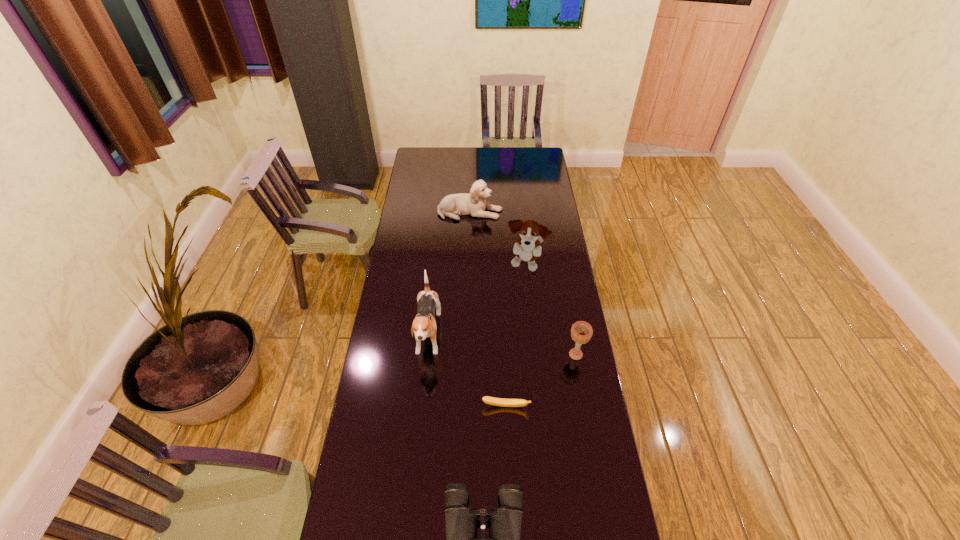
Find the location of a particular element. The width and height of the screenshot is (960, 540). empty space that is in between the farthest object and the shortest object is located at coordinates (488, 309).

You are a GUI agent. You are given a task and a screenshot of the screen. Output one action in this format:
    pyautogui.click(x=<x>, y=<y>)
    Task: Click on the empty space between the second farthest object and the chalice
    
    Given the screenshot: What is the action you would take?
    pyautogui.click(x=551, y=310)

Find the location of a particular element. empty location between the chalice and the second farthest object is located at coordinates (551, 310).

Point out which object is positioned as the second nearest to the farthest puppy. Please provide its 2D coordinates. Your answer should be formatted as a tuple, i.e. [(x, y)], where the tuple contains the x and y coordinates of a point satisfying the conditions above.

[(424, 325)]

This screenshot has height=540, width=960. I want to click on the fifth closest object relative to the nearest puppy, so click(474, 203).

At what (x,y) coordinates should I click in order to perform the action: click on puppy that stands as the closest to the nearest object. Please return your answer as a coordinate pair (x, y). The height and width of the screenshot is (540, 960). Looking at the image, I should click on (424, 325).

Choose which puppy is the nearest neighbor to the nearest puppy. Please provide its 2D coordinates. Your answer should be formatted as a tuple, i.e. [(x, y)], where the tuple contains the x and y coordinates of a point satisfying the conditions above.

[(527, 248)]

At what (x,y) coordinates should I click in order to perform the action: click on vacant space that satisfies the following two spatial constraints: 1. on the face of the second farthest puppy; 2. on the right side of the rightmost object. Please return your answer as a coordinate pair (x, y). Looking at the image, I should click on (535, 355).

Identify the location of free space that satisfies the following two spatial constraints: 1. on the front-facing side of the shortest puppy; 2. on the right side of the chalice. The width and height of the screenshot is (960, 540). (467, 355).

You are a GUI agent. You are given a task and a screenshot of the screen. Output one action in this format:
    pyautogui.click(x=<x>, y=<y>)
    Task: Click on the free region that satisfies the following two spatial constraints: 1. on the front-facing side of the farthest puppy; 2. at the face of the nearest puppy
    
    Given the screenshot: What is the action you would take?
    pyautogui.click(x=467, y=338)